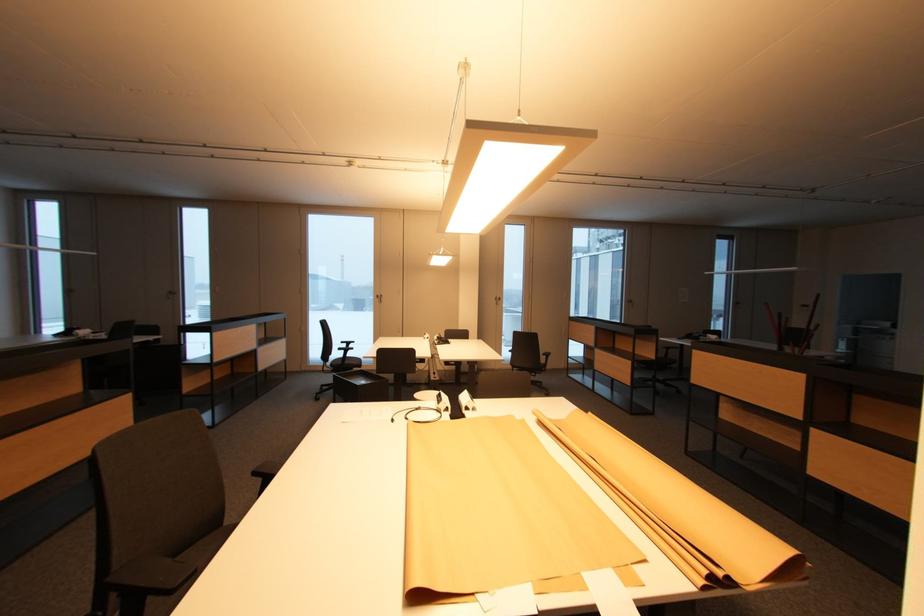
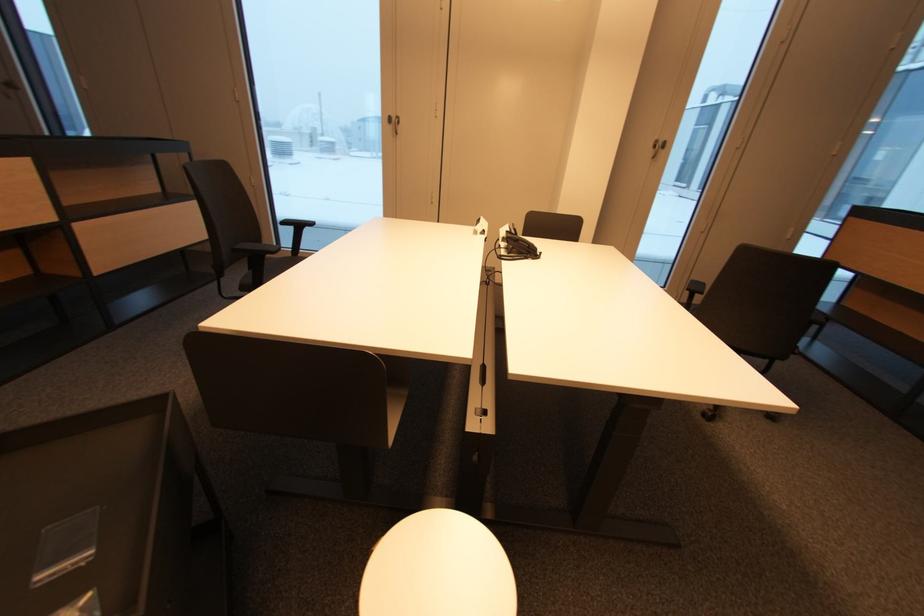
Question: What movement of the cameraman would produce the second image?

Choices:
 (A) Left
 (B) Right
 (C) Forward
 (D) Backward

Answer: (C)